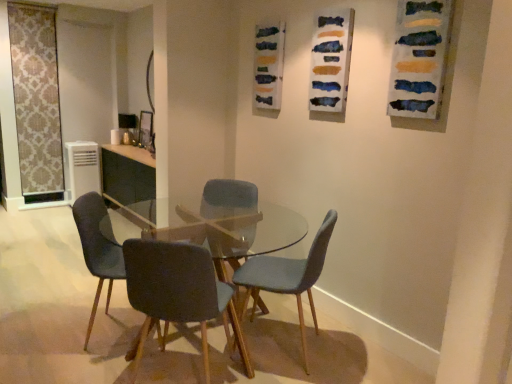
Question: Does watercolor paint at upper center appear on the right side of white plastic air conditioner at left?

Choices:
 (A) yes
 (B) no

Answer: (A)

Question: Is white plastic air conditioner at left completely or partially inside watercolor paint at upper center?

Choices:
 (A) no
 (B) yes

Answer: (A)

Question: Does watercolor paint at upper center have a lesser height compared to white plastic air conditioner at left?

Choices:
 (A) yes
 (B) no

Answer: (A)

Question: Is watercolor paint at upper center oriented towards white plastic air conditioner at left?

Choices:
 (A) yes
 (B) no

Answer: (B)

Question: Considering the relative sizes of watercolor paint at upper center and white plastic air conditioner at left in the image provided, is watercolor paint at upper center taller than white plastic air conditioner at left?

Choices:
 (A) no
 (B) yes

Answer: (A)

Question: Based on their sizes in the image, would you say velvet blue chair at center, which ranks as the 2th chair in right-to-left order, is bigger or smaller than dark gray fabric chair at center, acting as the 3th chair starting from the right?

Choices:
 (A) small
 (B) big

Answer: (A)

Question: Is velvet blue chair at center, the 3th chair in the left-to-right sequence, situated inside dark gray fabric chair at center, acting as the 3th chair starting from the right, or outside?

Choices:
 (A) outside
 (B) inside

Answer: (A)

Question: Considering the positions of point (254, 187) and point (185, 299), is point (254, 187) closer or farther from the camera than point (185, 299)?

Choices:
 (A) farther
 (B) closer

Answer: (A)

Question: Considering the positions of velvet blue chair at center, the 3th chair in the left-to-right sequence, and dark gray fabric chair at center, acting as the 3th chair starting from the right, in the image, is velvet blue chair at center, the 3th chair in the left-to-right sequence, taller or shorter than dark gray fabric chair at center, acting as the 3th chair starting from the right,?

Choices:
 (A) short
 (B) tall

Answer: (A)

Question: From the image's perspective, is white plastic air conditioner at left above or below velvet dark blue chair at center, acting as the 1th chair starting from the left?

Choices:
 (A) below
 (B) above

Answer: (B)

Question: In terms of size, does white plastic air conditioner at left appear bigger or smaller than velvet dark blue chair at center, which is the 4th chair in right-to-left order?

Choices:
 (A) small
 (B) big

Answer: (A)

Question: Considering the positions of white plastic air conditioner at left and velvet dark blue chair at center, acting as the 1th chair starting from the left, in the image, is white plastic air conditioner at left taller or shorter than velvet dark blue chair at center, acting as the 1th chair starting from the left,?

Choices:
 (A) tall
 (B) short

Answer: (B)

Question: From a real-world perspective, relative to velvet dark blue chair at center, which is the 4th chair in right-to-left order, is white plastic air conditioner at left vertically above or below?

Choices:
 (A) above
 (B) below

Answer: (B)

Question: Considering their positions, is velvet blue chair at center, the 3th chair in the left-to-right sequence, located in front of or behind velvet dark blue chair at center, which is the 4th chair in right-to-left order?

Choices:
 (A) behind
 (B) front

Answer: (A)

Question: From the image's perspective, is velvet blue chair at center, the 3th chair in the left-to-right sequence, located above or below velvet dark blue chair at center, acting as the 1th chair starting from the left?

Choices:
 (A) below
 (B) above

Answer: (B)